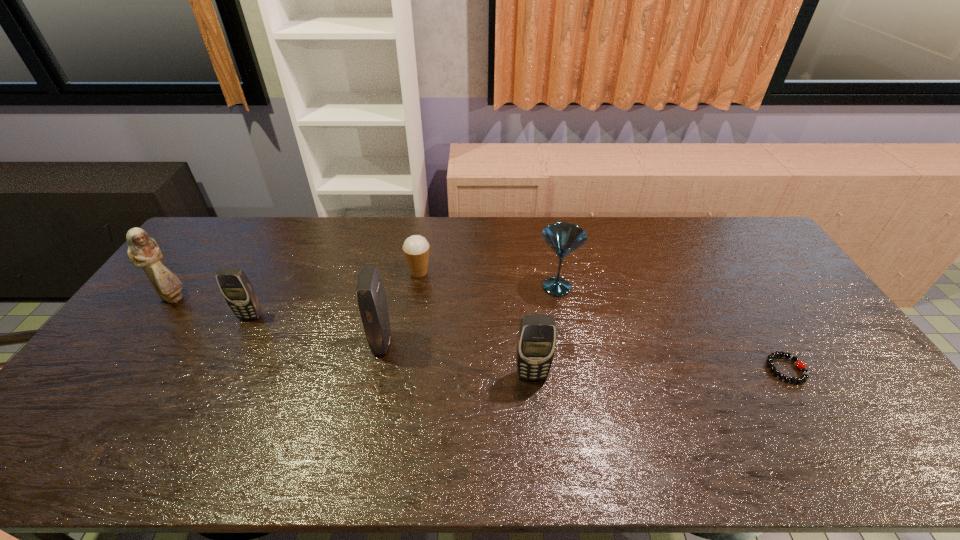
At what (x,y) coordinates should I click in order to perform the action: click on bracelet. Please return your answer as a coordinate pair (x, y). Image resolution: width=960 pixels, height=540 pixels. Looking at the image, I should click on (805, 373).

This screenshot has height=540, width=960. What are the coordinates of `the leftmost object` in the screenshot? It's located at (143, 251).

The height and width of the screenshot is (540, 960). In order to click on vacant space located 0.160m on the front face of the sixth object from right to left in this screenshot , I will do `click(226, 364)`.

Find the location of a particular element. free space located 0.390m on the front face of the second nearest cellular telephone is located at coordinates (236, 344).

What are the coordinates of `free space located on the front face of the second nearest cellular telephone` in the screenshot? It's located at (289, 344).

Identify the location of free spot located 0.120m on the front face of the second nearest cellular telephone. The width and height of the screenshot is (960, 540). (331, 344).

This screenshot has width=960, height=540. In order to click on vacant space situated 0.110m on the right of the icecream in this screenshot , I will do `click(465, 272)`.

You are a GUI agent. You are given a task and a screenshot of the screen. Output one action in this format:
    pyautogui.click(x=<x>, y=<y>)
    Task: Click on the free space located on the back of the martini
    
    Given the screenshot: What is the action you would take?
    pyautogui.click(x=543, y=218)

This screenshot has width=960, height=540. In order to click on free location located 0.090m on the back of the bracelet in this screenshot , I will do `click(761, 329)`.

Find the location of a particular element. vacant space positioned 0.380m on the front-facing side of the leftmost object is located at coordinates (309, 298).